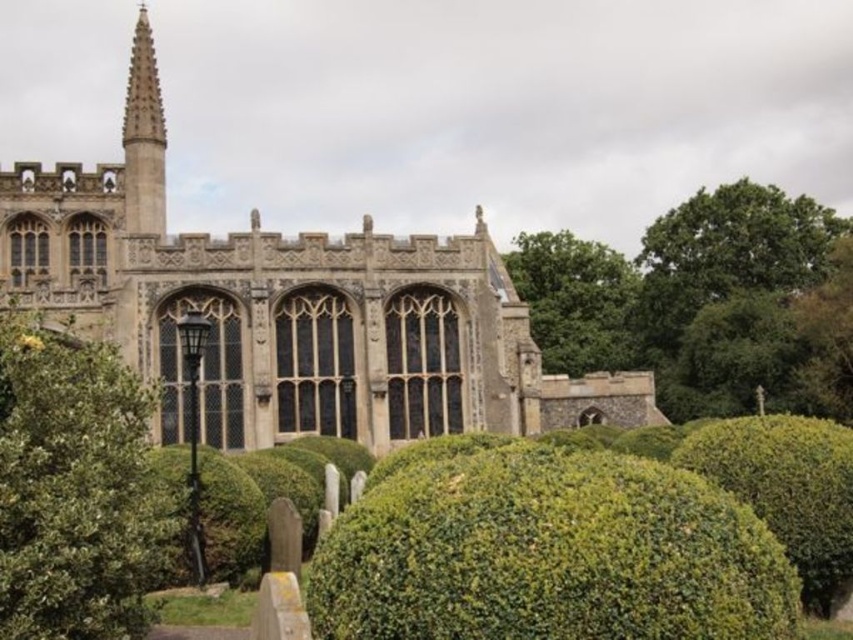
Does green leafy tree at right have a lesser width compared to green leafy bush at lower left?

Incorrect, green leafy tree at right's width is not less than green leafy bush at lower left's.

Can you confirm if green leafy tree at right is smaller than green leafy bush at lower left?

No, green leafy tree at right is not smaller than green leafy bush at lower left.

Which is behind, point (582, 300) or point (242, 506)?

Point (582, 300)

The width and height of the screenshot is (853, 640). I want to click on green leafy tree at right, so click(x=705, y=301).

Can you confirm if beige stone church at center is positioned to the right of green leafy tree at upper right?

No, beige stone church at center is not to the right of green leafy tree at upper right.

Which is in front, point (387, 268) or point (525, 276)?

Point (387, 268)

Find the location of a particular element. The image size is (853, 640). beige stone church at center is located at coordinates (300, 323).

Image resolution: width=853 pixels, height=640 pixels. I want to click on beige stone church at center, so click(x=300, y=323).

Is green leafy hedge at lower center below green leafy bush at lower right?

No.

Is point (477, 564) in front of point (729, 468)?

That is True.

Locate an element on the screen. green leafy hedge at lower center is located at coordinates (546, 552).